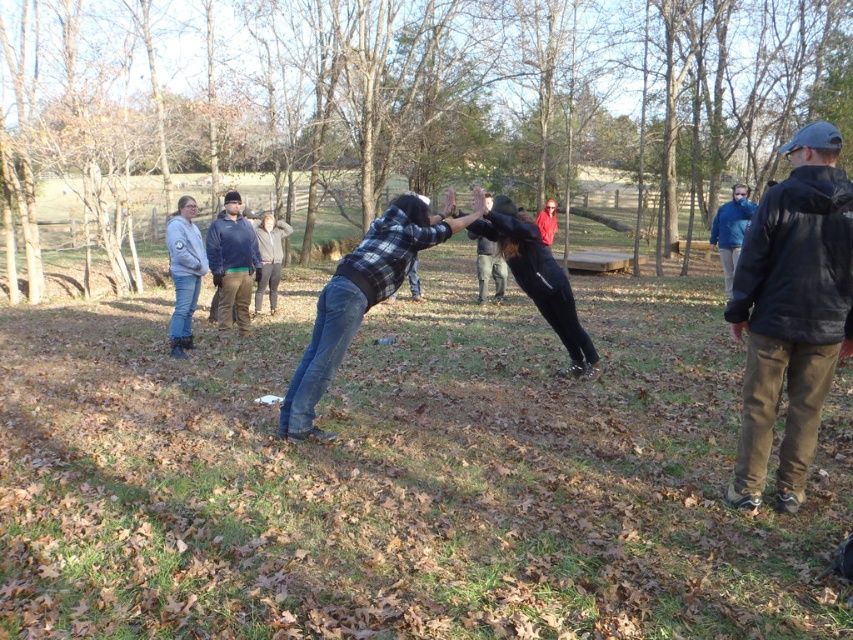
You are standing at point (x=271, y=284) and want to walk towards point (x=294, y=419). Which direction should you move relative to the other point?

You should move forward towards point (x=294, y=419) since it is in front of point (x=271, y=284).

You are standing at the center of the park and want to locate the blue fleece jacket at upper right. According to the coordinates provided, in which direction should you look to find it?

The blue fleece jacket at upper right is located at coordinates point (730,230), so you should look towards the upper right direction from your current position at the center of the park.

You are standing in the park and see the blue fleece jacket at upper right and the plaid flannel shirt at center. Which one is located more to the right side?

The blue fleece jacket at upper right is more to the right side because it is positioned on the right side of the plaid flannel shirt at center.